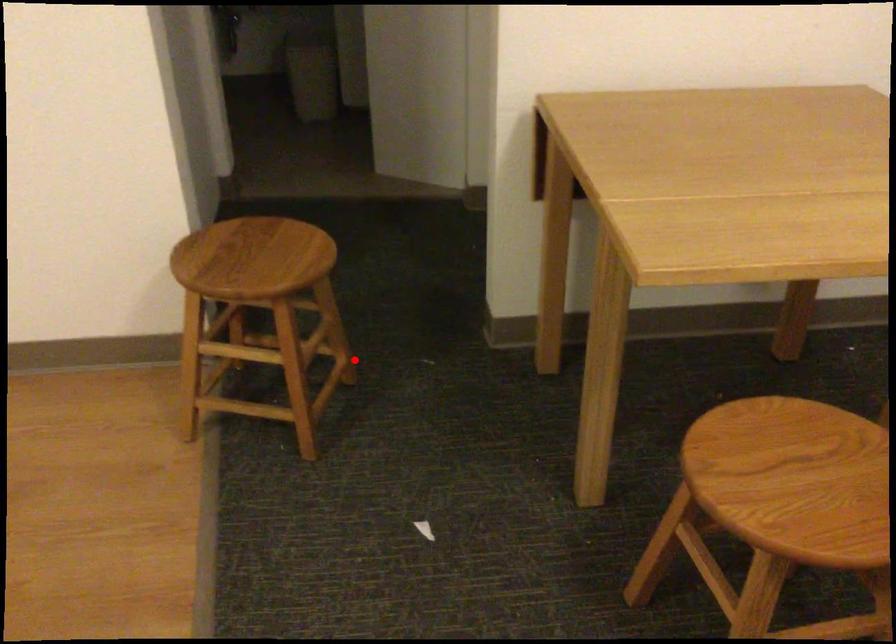
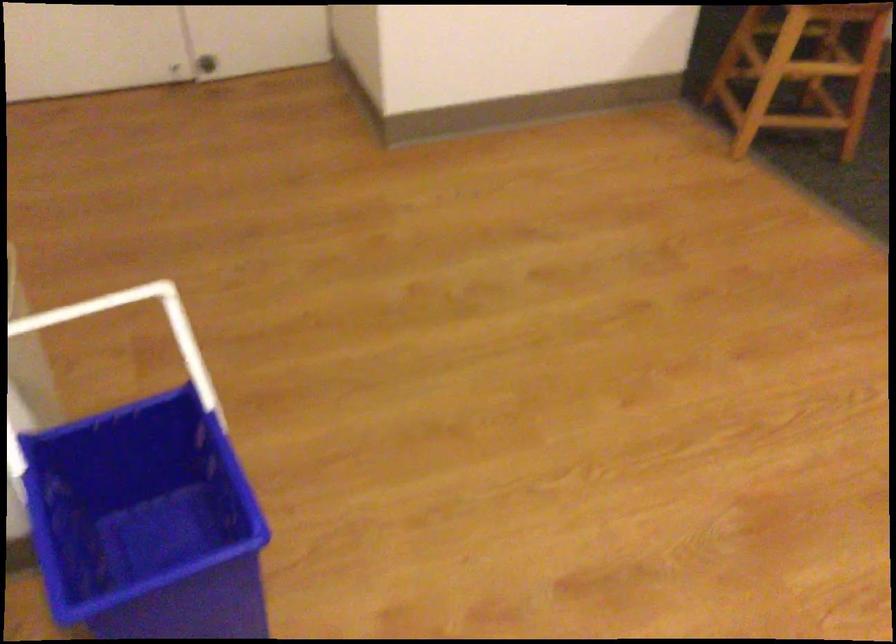
Question: I am providing you with two images of the same scene from different viewpoints. Image1 has a red point marked. In image2, the corresponding 3D location appears at what relative position? Reply with the corresponding letter.

Choices:
 (A) Closer
 (B) Farther

Answer: (B)